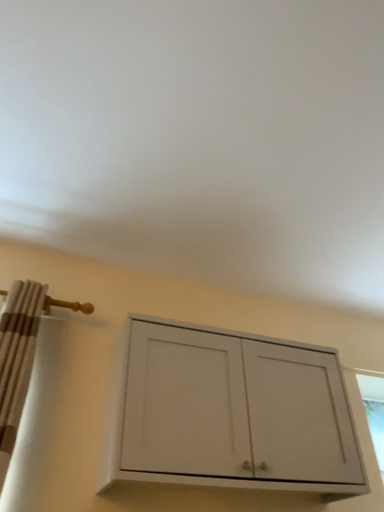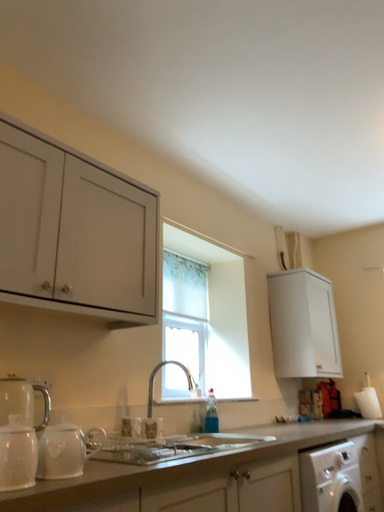
Question: How did the camera likely rotate when shooting the video?

Choices:
 (A) rotated downward
 (B) rotated upward

Answer: (A)